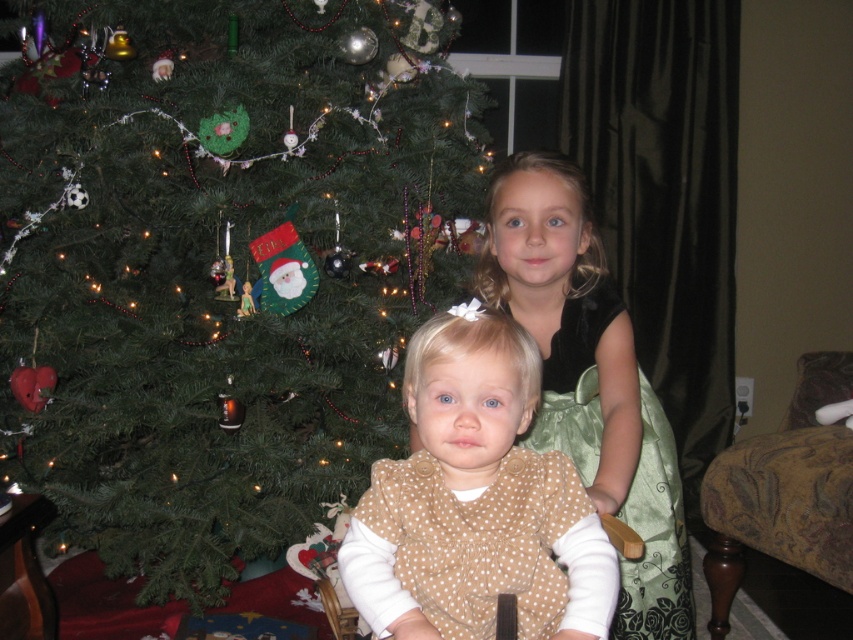
Between brown polka dot dress at center and green satin dress at upper right, which one is positioned lower?

brown polka dot dress at center is below.

Does brown polka dot dress at center appear on the left side of green satin dress at upper right?

Correct, you'll find brown polka dot dress at center to the left of green satin dress at upper right.

Between point (596, 580) and point (654, 420), which one is positioned in front?

Point (596, 580)

At what (x,y) coordinates should I click in order to perform the action: click on brown polka dot dress at center. Please return your answer as a coordinate pair (x, y). Looking at the image, I should click on (474, 500).

Does point (74, 150) lie behind point (660, 410)?

That is True.

Which is behind, point (151, 477) or point (596, 442)?

Positioned behind is point (151, 477).

Which is behind, point (80, 108) or point (682, 630)?

Point (80, 108)

This screenshot has height=640, width=853. Identify the location of green matte christmas tree at center. (219, 260).

Which is below, green matte christmas tree at center or patterned fabric rocking chair at lower right?

Positioned lower is patterned fabric rocking chair at lower right.

Does green matte christmas tree at center have a lesser width compared to patterned fabric rocking chair at lower right?

Incorrect, green matte christmas tree at center's width is not less than patterned fabric rocking chair at lower right's.

Who is more forward, (x=254, y=1) or (x=837, y=506)?

Positioned in front is point (x=837, y=506).

You are a GUI agent. You are given a task and a screenshot of the screen. Output one action in this format:
    pyautogui.click(x=<x>, y=<y>)
    Task: Click on the green matte christmas tree at center
    
    Given the screenshot: What is the action you would take?
    pyautogui.click(x=219, y=260)